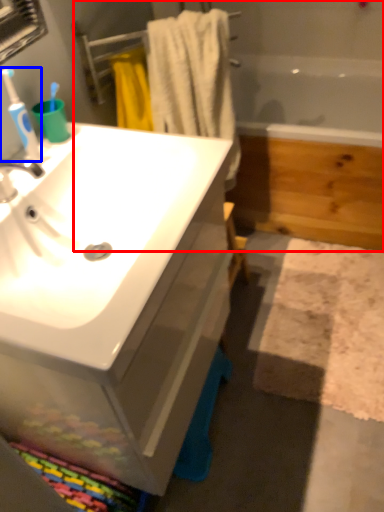
Question: Which point is further to the camera, bath (highlighted by a red box) or toothbrush (highlighted by a blue box)?

Choices:
 (A) bath
 (B) toothbrush

Answer: (A)